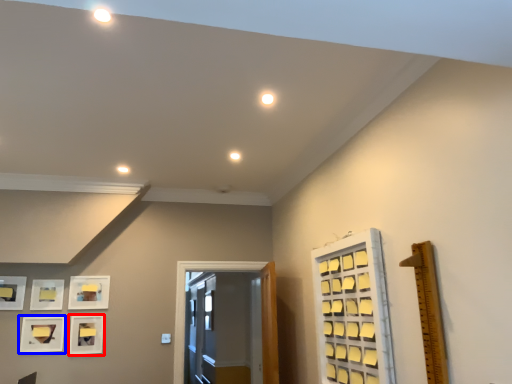
Question: Which object appears farthest to the camera in this image, picture frame (highlighted by a red box) or picture frame (highlighted by a blue box)?

Choices:
 (A) picture frame
 (B) picture frame

Answer: (A)